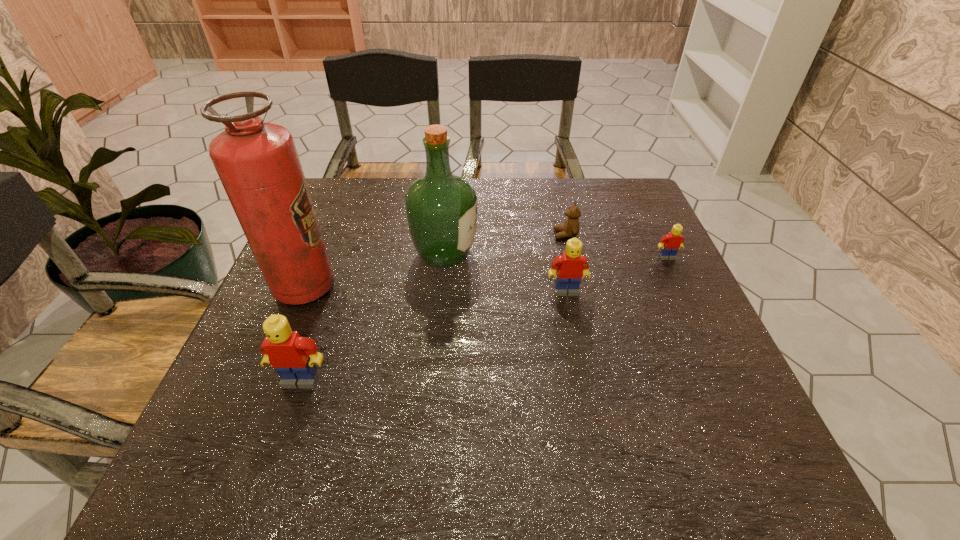
Image resolution: width=960 pixels, height=540 pixels. Identify the location of free space that is in between the farthest Lego and the second Lego from left to right. (616, 274).

Image resolution: width=960 pixels, height=540 pixels. In order to click on vacant area that lies between the tallest object and the second farthest Lego in this screenshot , I will do `click(435, 289)`.

Identify the location of empty space that is in between the second tallest object and the second Lego from right to left. (505, 273).

Locate an element on the screen. free space between the fourth object from right to left and the fourth tallest object is located at coordinates (505, 273).

Locate an element on the screen. free space that is in between the second Lego from right to left and the tallest object is located at coordinates (435, 289).

Image resolution: width=960 pixels, height=540 pixels. In order to click on vacant space in between the nearest Lego and the rightmost object in this screenshot , I will do `click(484, 319)`.

Where is `vacant region between the second shortest Lego and the tallest object`? This screenshot has height=540, width=960. vacant region between the second shortest Lego and the tallest object is located at coordinates (435, 289).

Select which object is the closest to the teddy bear. Please provide its 2D coordinates. Your answer should be formatted as a tuple, i.e. [(x, y)], where the tuple contains the x and y coordinates of a point satisfying the conditions above.

[(570, 266)]

At what (x,y) coordinates should I click in order to perform the action: click on object that can be found as the closest to the second tallest Lego. Please return your answer as a coordinate pair (x, y). This screenshot has width=960, height=540. Looking at the image, I should click on point(571,226).

What are the coordinates of `Lego that is the second closest one to the leftmost Lego` in the screenshot? It's located at (670, 243).